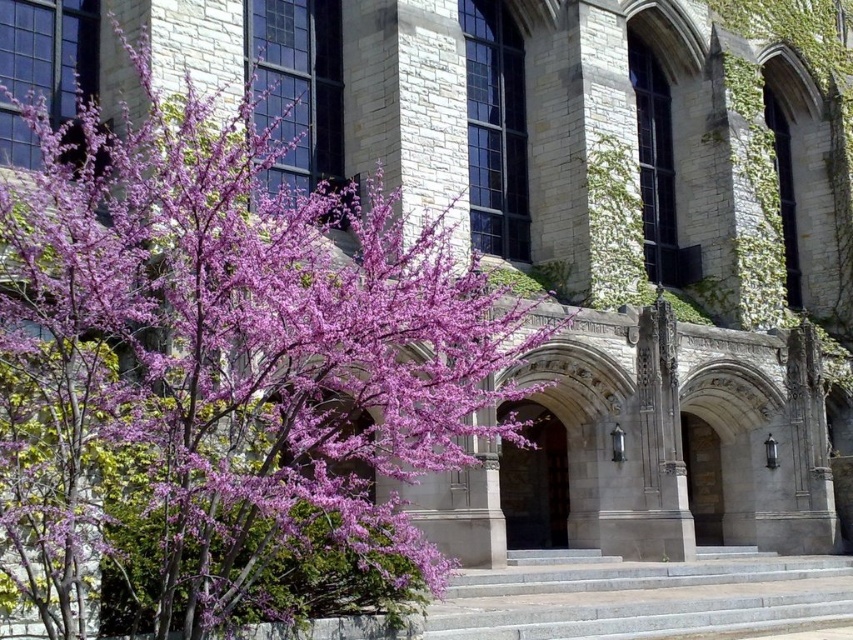
Does purple matte tree at left have a lesser width compared to gray stone stairs at center?

Incorrect, purple matte tree at left's width is not less than gray stone stairs at center's.

Is purple matte tree at left wider than gray stone stairs at center?

Yes.

Find the location of a particular element. Image resolution: width=853 pixels, height=640 pixels. purple matte tree at left is located at coordinates (223, 376).